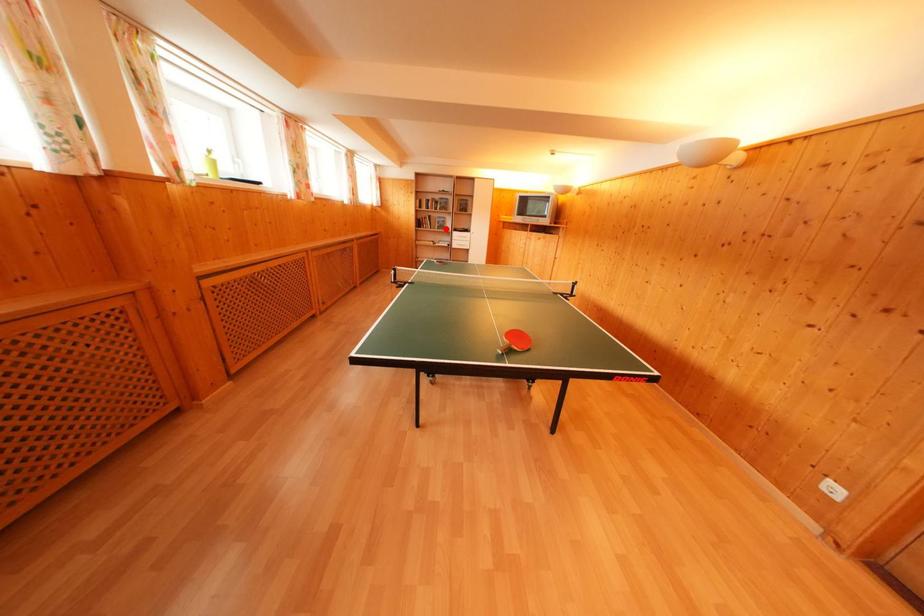
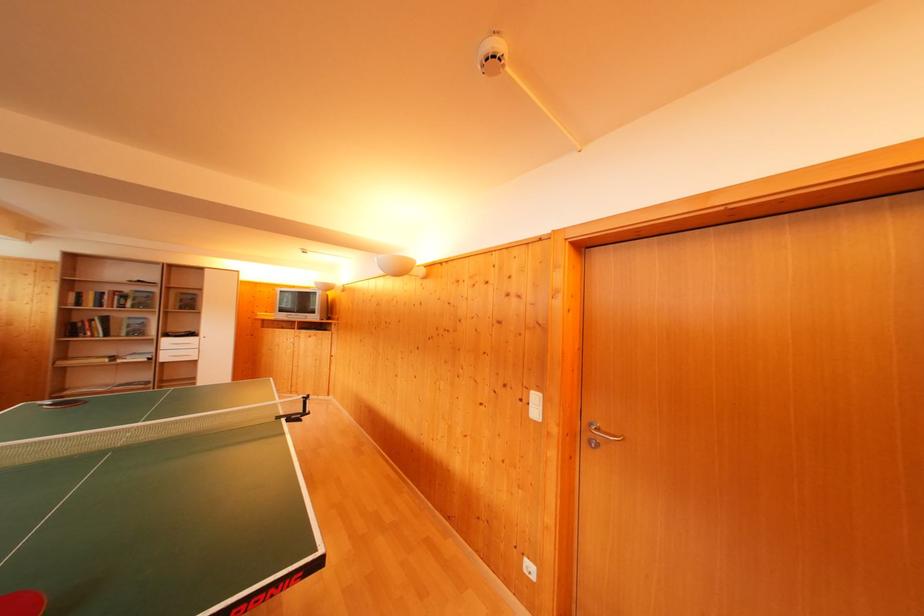
Question: I am providing you with two images of the same scene from different viewpoints. In image1, a red point is highlighted. Considering the same 3D point in image2, which of the following is correct?

Choices:
 (A) It is closer
 (B) It is farther

Answer: (B)